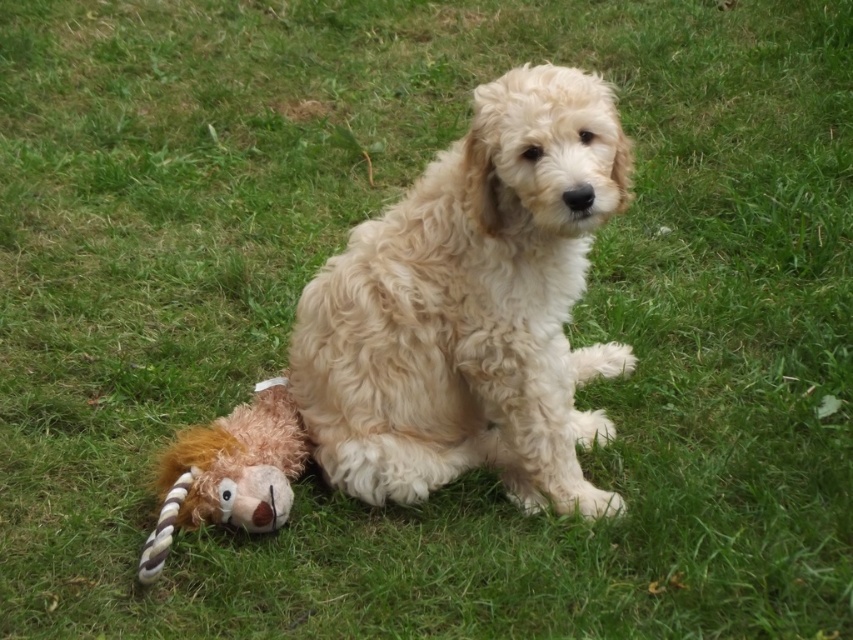
You are a photographer trying to capture the perfect shot of the fluffy white dog at center. Based on its position coordinates, where should you aim your camera to ensure the dog is centered in the frame?

The fluffy white dog at center is located at coordinates point [473,308], so aiming the camera at that point will center the dog in the frame.

You are a photographer standing at a certain distance from the fluffy white dog at center. You want to take a closeup shot of the dog without using a zoom lens. What is the minimum distance you need to move closer to the dog to achieve this?

The minimum distance you need to move closer to the fluffy white dog at center is 1.69 meters minus your current distance. However, since the current distance is not specified, you can approach until you reach the desired closeup framing, keeping in mind the original distance is 1.69 meters.